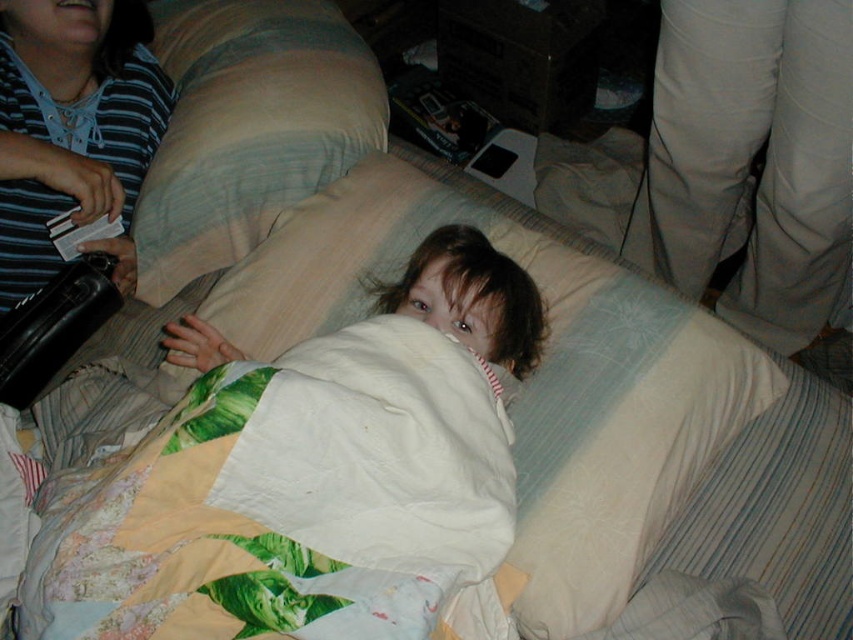
You are a parent trying to make sure your child is comfortable. You have a white quilted blanket at center and a white textured pillow at upper center. Which item takes up more space in the image?

The white textured pillow at upper center takes up more space than the white quilted blanket at center.

You are a photographer trying to capture the best angle of the child lying on the bed. You want to ensure both the white quilted blanket at center and the white textured pillow at upper center are clearly visible in the shot. Based on their positions, which object should you focus on first to ensure both are in sharp focus?

The white quilted blanket at center is closer to the viewer than the white textured pillow at upper center. To ensure both are in sharp focus, focus on the white quilted blanket at center first, as it is closer, and the pillow will naturally fall into focus behind it.

You are a parent trying to make sure your child is comfortable. You see the white quilted blanket at center and the white textured pillow at upper center. Which item is positioned lower in the image?

The white quilted blanket at center is positioned lower than the white textured pillow at upper center.